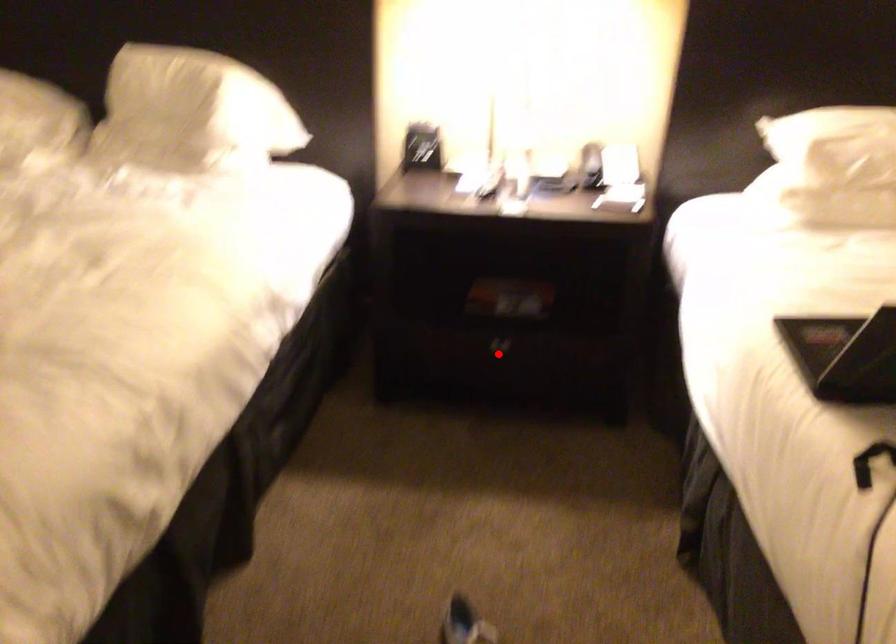
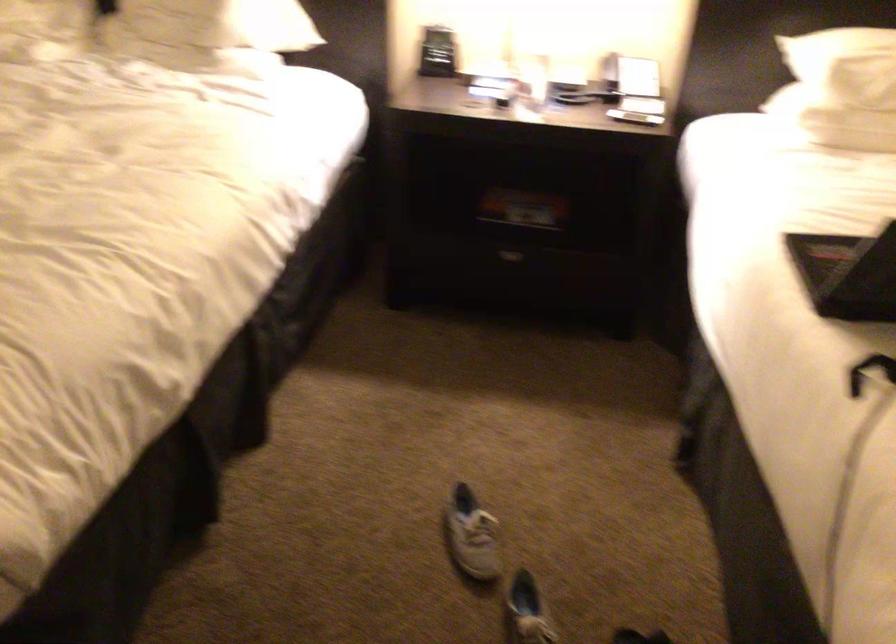
Locate, in the second image, the point that corresponds to the highlighted location in the first image.

(506, 261)